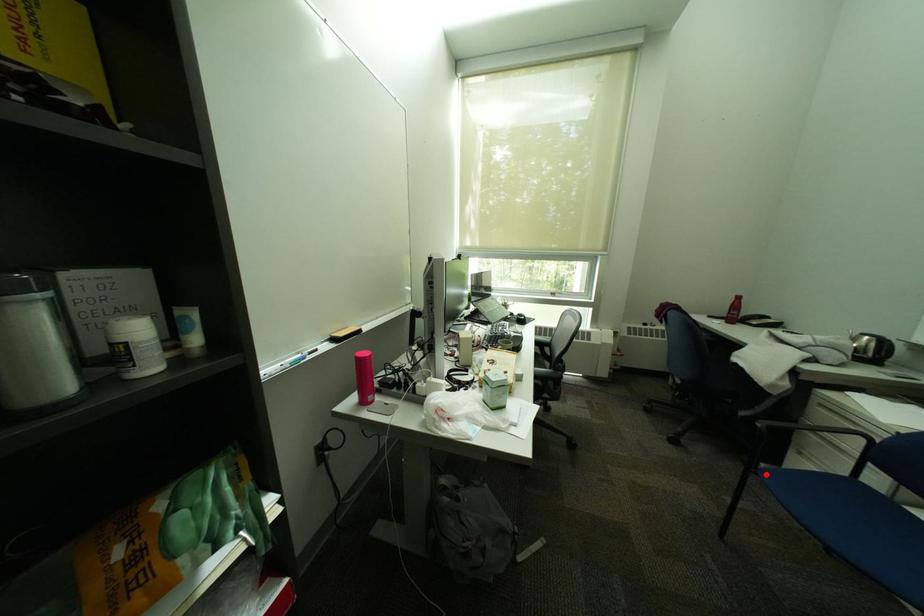
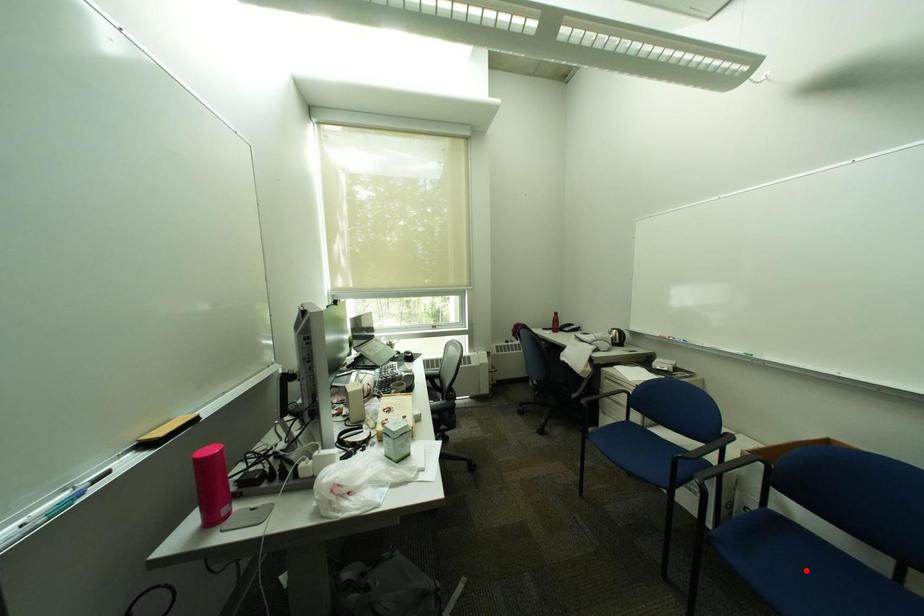
I am providing you with two images of the same scene from different viewpoints. A red point is marked on the first image and another point is marked on the second image. Do the highlighted points in image1 and image2 indicate the same real-world spot?

No